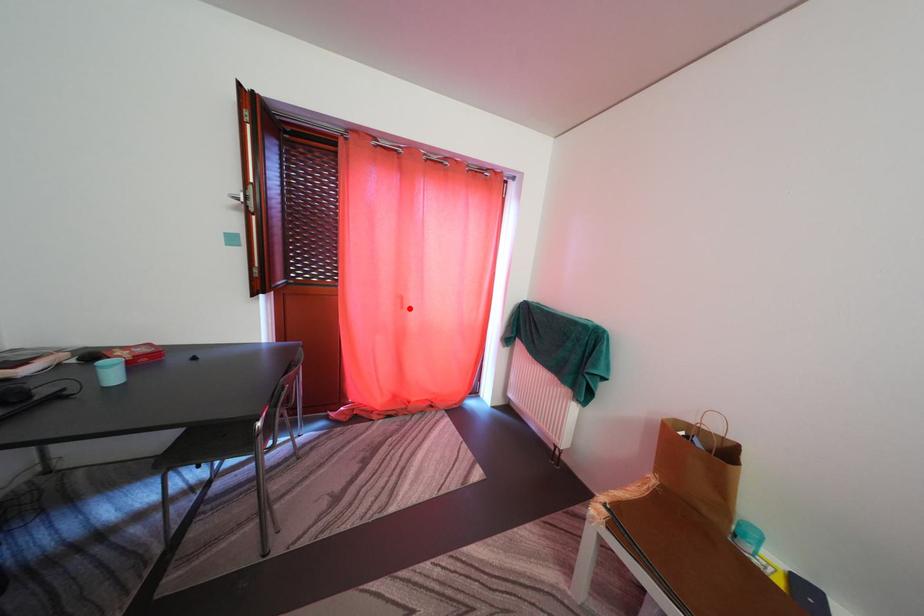
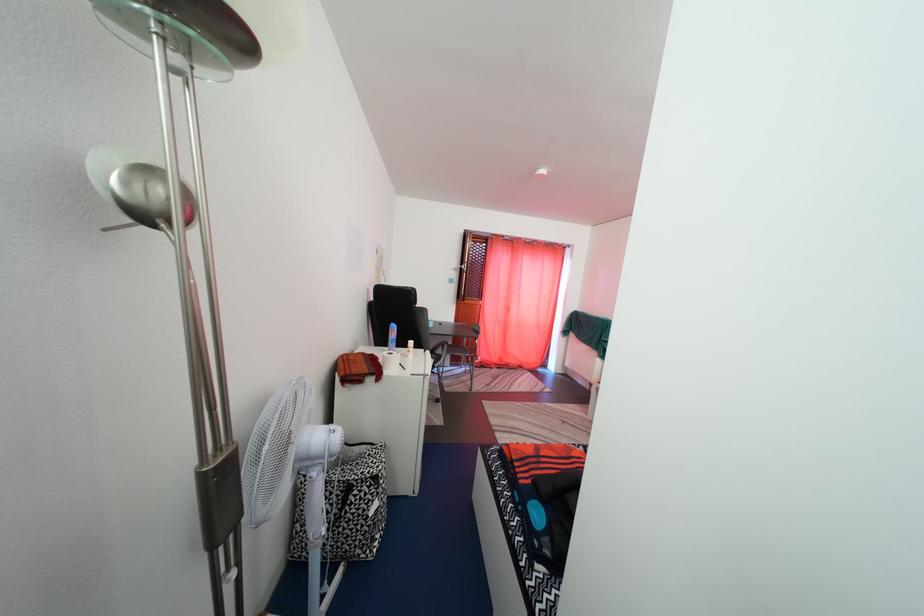
Question: I am providing you with two images of the same scene from different viewpoints. In image1, a red point is highlighted. Considering the same 3D point in image2, which of the following is correct?

Choices:
 (A) It is closer
 (B) It is farther

Answer: (B)